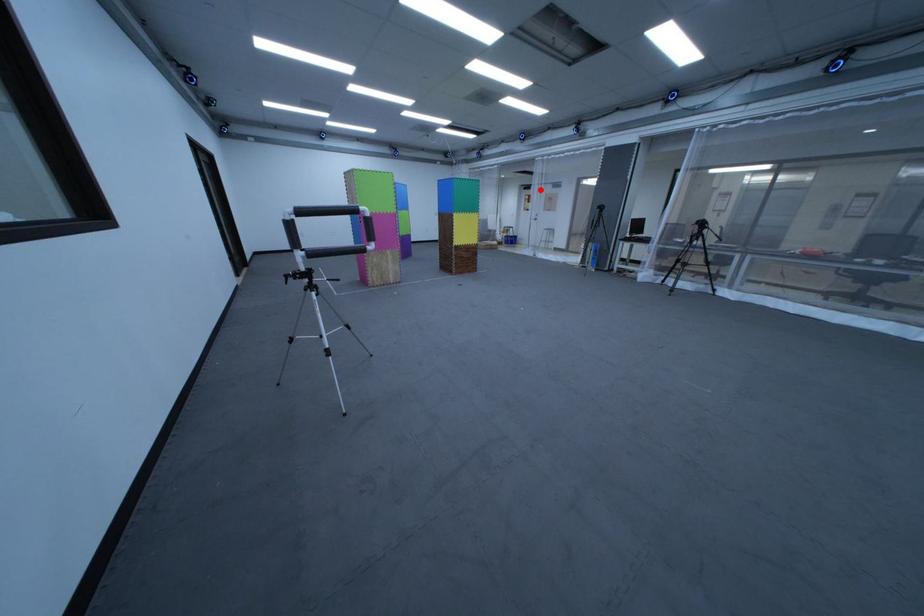
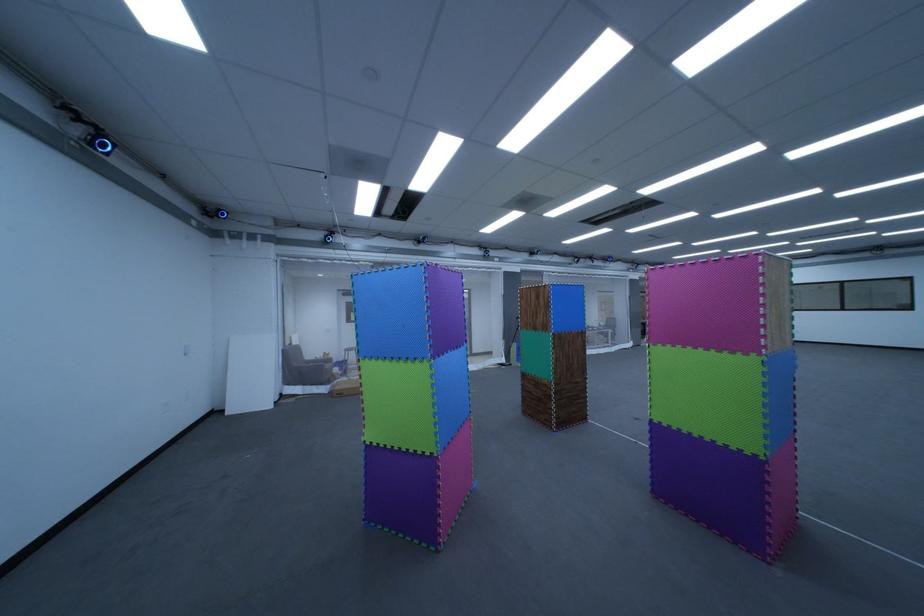
Question: I am providing you with two images of the same scene from different viewpoints. In image1, a red point is highlighted. Considering the same 3D point in image2, which of the following is correct?

Choices:
 (A) It is closer
 (B) It is farther

Answer: (B)